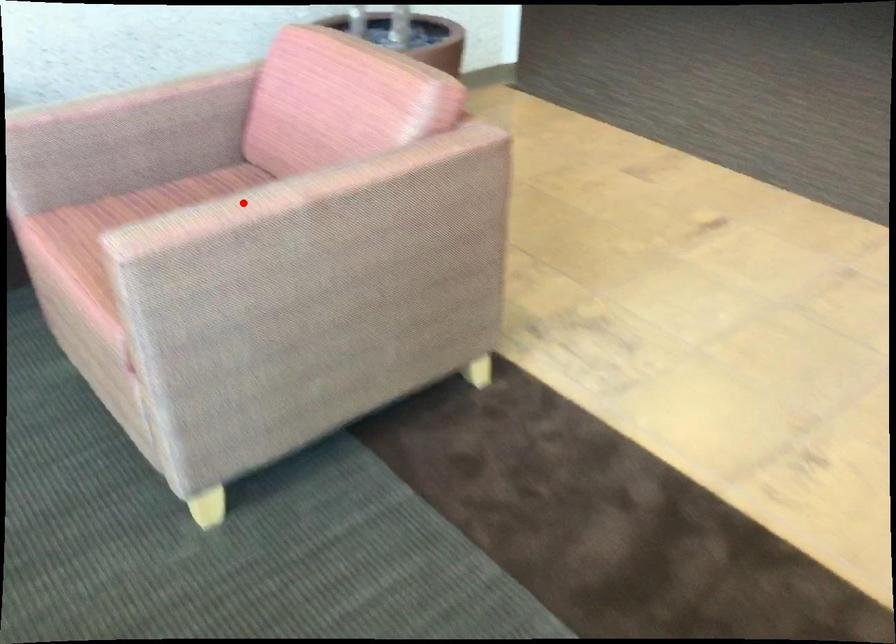
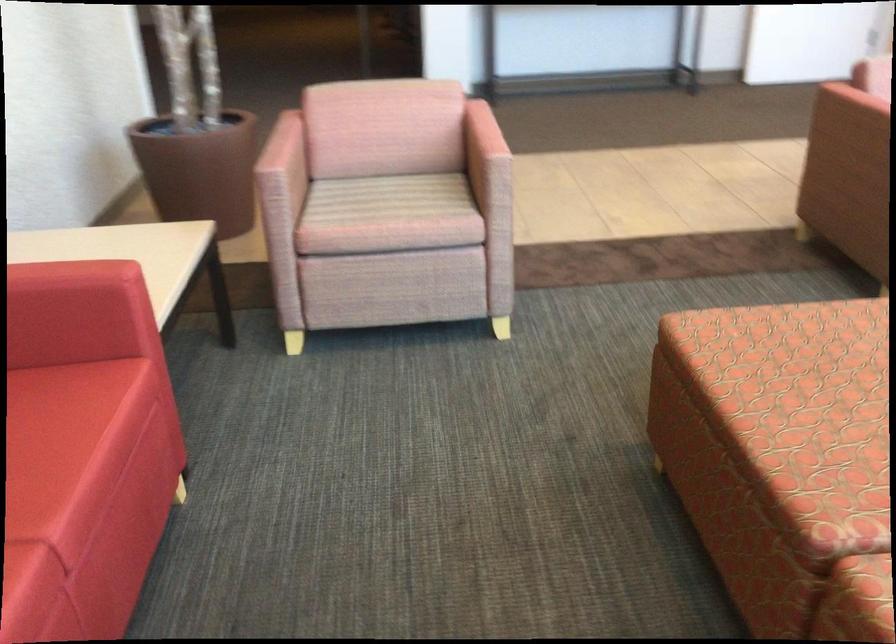
In the second image, find the point that corresponds to the highlighted location in the first image.

(481, 133)